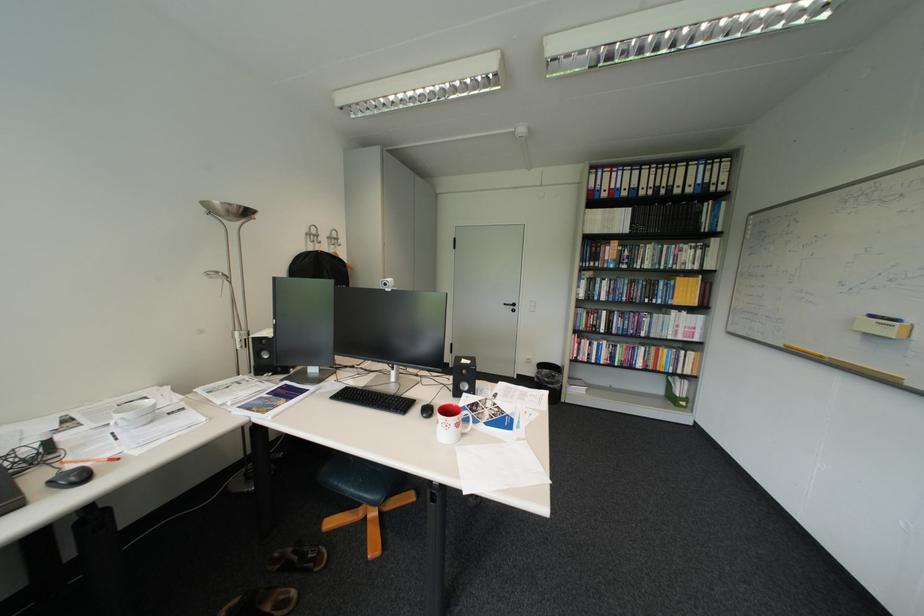
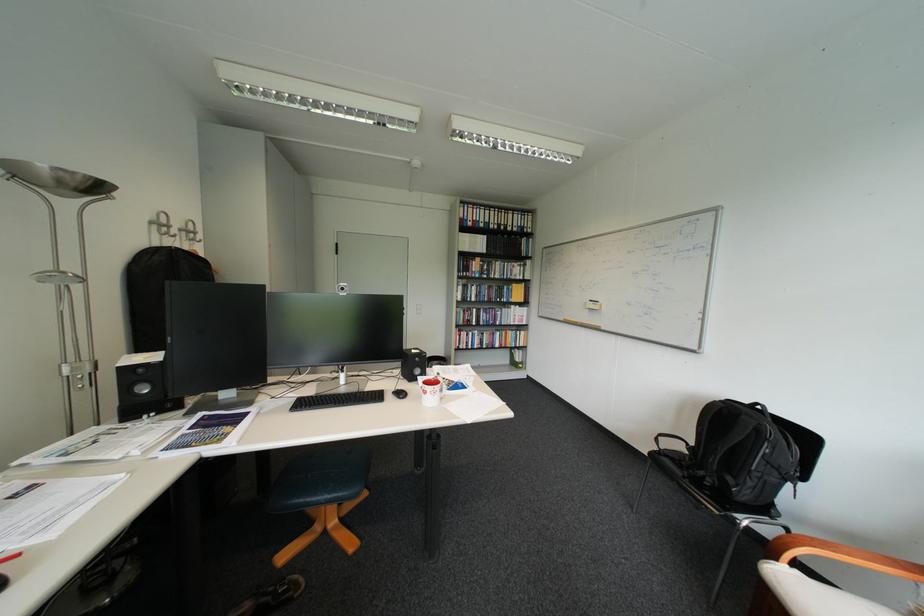
Locate, in the second image, the point that corresponds to (332,243) in the first image.

(187, 237)